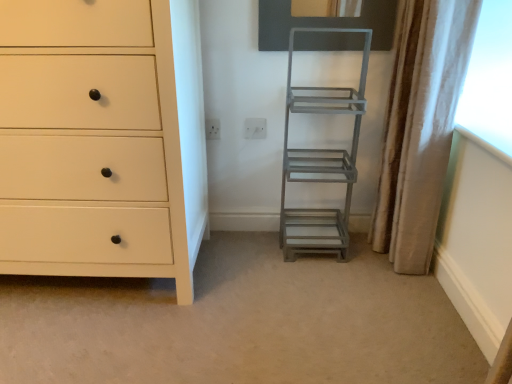
The image size is (512, 384). What are the coordinates of `white plastic electric outlet at center, marked as the first electric outlet in a right-to-left arrangement` in the screenshot? It's located at (255, 128).

Looking at this image, measure the distance between point [207,122] and camera.

Point [207,122] is 1.73 meters away from camera.

You are a GUI agent. You are given a task and a screenshot of the screen. Output one action in this format:
    pyautogui.click(x=<x>, y=<y>)
    Task: Click on the beige fabric curtain at right
    This screenshot has width=512, height=384.
    Given the screenshot: What is the action you would take?
    pyautogui.click(x=422, y=128)

Are matte white chest of drawers at left and white plastic electric outlet at center, marked as the first electric outlet in a right-to-left arrangement, beside each other?

No, matte white chest of drawers at left is not next to white plastic electric outlet at center, marked as the first electric outlet in a right-to-left arrangement.

Considering the sizes of objects matte white chest of drawers at left and white plastic electric outlet at center, the second electric outlet viewed from the left, in the image provided, who is wider, matte white chest of drawers at left or white plastic electric outlet at center, the second electric outlet viewed from the left,?

matte white chest of drawers at left is wider.

Do you think matte white chest of drawers at left is within white plastic electric outlet at center, the second electric outlet viewed from the left, or outside of it?

matte white chest of drawers at left is spatially situated outside white plastic electric outlet at center, the second electric outlet viewed from the left.

Which of these two, matte white chest of drawers at left or white plastic electric outlet at center, marked as the first electric outlet in a right-to-left arrangement, is smaller?

white plastic electric outlet at center, marked as the first electric outlet in a right-to-left arrangement.

Which object is more forward, gray matte metal ladder at center-right or white plastic electric outlet at center, marked as the first electric outlet in a right-to-left arrangement?

gray matte metal ladder at center-right is more forward.

From the picture: How different are the orientations of gray matte metal ladder at center-right and white plastic electric outlet at center, marked as the first electric outlet in a right-to-left arrangement, in degrees?

0.274 degrees separate the facing orientations of gray matte metal ladder at center-right and white plastic electric outlet at center, marked as the first electric outlet in a right-to-left arrangement.

Is there a large distance between gray matte metal ladder at center-right and white plastic electric outlet at center, the second electric outlet viewed from the left?

gray matte metal ladder at center-right is actually quite close to white plastic electric outlet at center, the second electric outlet viewed from the left.

Does gray matte metal ladder at center-right appear on the left side of white plastic electric outlet at center, the second electric outlet viewed from the left?

No, gray matte metal ladder at center-right is not to the left of white plastic electric outlet at center, the second electric outlet viewed from the left.

Is white plastic electric outlet at center, marked as the first electric outlet in a right-to-left arrangement, aimed at white plastic electric outlet at center, the 1th electric outlet from the left?

No, white plastic electric outlet at center, marked as the first electric outlet in a right-to-left arrangement, is not turned towards white plastic electric outlet at center, the 1th electric outlet from the left.

How many degrees apart are the facing directions of white plastic electric outlet at center, the second electric outlet viewed from the left, and white plastic electric outlet at center, the 1th electric outlet from the left?

white plastic electric outlet at center, the second electric outlet viewed from the left, and white plastic electric outlet at center, the 1th electric outlet from the left, are facing 0.0172 degrees away from each other.

Does white plastic electric outlet at center, the second electric outlet viewed from the left, have a larger size compared to white plastic electric outlet at center, the 1th electric outlet from the left?

Indeed, white plastic electric outlet at center, the second electric outlet viewed from the left, has a larger size compared to white plastic electric outlet at center, the 1th electric outlet from the left.

In the scene shown: Can you tell me how much beige fabric curtain at right and matte white chest of drawers at left differ in facing direction?

The angular difference between beige fabric curtain at right and matte white chest of drawers at left is 87.6 degrees.

Considering the sizes of objects beige fabric curtain at right and matte white chest of drawers at left in the image provided, who is smaller, beige fabric curtain at right or matte white chest of drawers at left?

beige fabric curtain at right.

From a real-world perspective, is beige fabric curtain at right positioned above or below matte white chest of drawers at left?

beige fabric curtain at right is situated higher than matte white chest of drawers at left in the real world.

From the image's perspective, is beige fabric curtain at right located above or below matte white chest of drawers at left?

beige fabric curtain at right is situated higher than matte white chest of drawers at left in the image.

Identify the location of curtain above the gray matte metal ladder at center-right (from a real-world perspective). (422, 128).

Would you consider gray matte metal ladder at center-right to be distant from beige fabric curtain at right?

No, gray matte metal ladder at center-right is not far away from beige fabric curtain at right.

Is gray matte metal ladder at center-right situated inside beige fabric curtain at right or outside?

gray matte metal ladder at center-right is outside beige fabric curtain at right.

Which of these two, gray matte metal ladder at center-right or beige fabric curtain at right, is wider?

Wider between the two is gray matte metal ladder at center-right.

Who is shorter, white plastic electric outlet at center, the 2th electric outlet in the right-to-left sequence, or white plastic electric outlet at center, the second electric outlet viewed from the left?

Standing shorter between the two is white plastic electric outlet at center, the 2th electric outlet in the right-to-left sequence.

From the picture: From the image's perspective, would you say white plastic electric outlet at center, the 1th electric outlet from the left, is shown under white plastic electric outlet at center, marked as the first electric outlet in a right-to-left arrangement?

No, from the image's perspective, white plastic electric outlet at center, the 1th electric outlet from the left, is not below white plastic electric outlet at center, marked as the first electric outlet in a right-to-left arrangement.

Can you confirm if white plastic electric outlet at center, the 1th electric outlet from the left, is smaller than white plastic electric outlet at center, the second electric outlet viewed from the left?

Correct, white plastic electric outlet at center, the 1th electric outlet from the left, occupies less space than white plastic electric outlet at center, the second electric outlet viewed from the left.

Can you tell me how much white plastic electric outlet at center, the 1th electric outlet from the left, and beige fabric curtain at right differ in facing direction?

85.9 degrees.

Is white plastic electric outlet at center, the 2th electric outlet in the right-to-left sequence, aimed at beige fabric curtain at right?

No, white plastic electric outlet at center, the 2th electric outlet in the right-to-left sequence, is not aimed at beige fabric curtain at right.

Between white plastic electric outlet at center, the 2th electric outlet in the right-to-left sequence, and beige fabric curtain at right, which one has more height?

beige fabric curtain at right.

Identify the location of chest of drawers in front of the white plastic electric outlet at center, the second electric outlet viewed from the left. The image size is (512, 384). (101, 139).

Identify the location of ladder on the right of white plastic electric outlet at center, the second electric outlet viewed from the left. pos(321,161).

In the scene shown: Looking at the image, which one is located closer to beige fabric curtain at right, matte white chest of drawers at left or white plastic electric outlet at center, the 1th electric outlet from the left?

white plastic electric outlet at center, the 1th electric outlet from the left, lies closer to beige fabric curtain at right than the other object.

Based on their spatial positions, is gray matte metal ladder at center-right or white plastic electric outlet at center, the second electric outlet viewed from the left, closer to matte white chest of drawers at left?

Based on the image, gray matte metal ladder at center-right appears to be nearer to matte white chest of drawers at left.

Estimate the real-world distances between objects in this image. Which object is closer to gray matte metal ladder at center-right, white plastic electric outlet at center, the 2th electric outlet in the right-to-left sequence, or matte white chest of drawers at left?

white plastic electric outlet at center, the 2th electric outlet in the right-to-left sequence.

Considering their positions, is gray matte metal ladder at center-right positioned further to white plastic electric outlet at center, the 2th electric outlet in the right-to-left sequence, than beige fabric curtain at right?

beige fabric curtain at right is further to white plastic electric outlet at center, the 2th electric outlet in the right-to-left sequence.

When comparing their distances from beige fabric curtain at right, does white plastic electric outlet at center, the 2th electric outlet in the right-to-left sequence, or white plastic electric outlet at center, the second electric outlet viewed from the left, seem further?

Based on the image, white plastic electric outlet at center, the 2th electric outlet in the right-to-left sequence, appears to be further to beige fabric curtain at right.

Which object lies further to the anchor point white plastic electric outlet at center, the 2th electric outlet in the right-to-left sequence, white plastic electric outlet at center, marked as the first electric outlet in a right-to-left arrangement, or matte white chest of drawers at left?

The object further to white plastic electric outlet at center, the 2th electric outlet in the right-to-left sequence, is matte white chest of drawers at left.

From the image, which object appears to be nearer to white plastic electric outlet at center, the second electric outlet viewed from the left, gray matte metal ladder at center-right or white plastic electric outlet at center, the 2th electric outlet in the right-to-left sequence?

white plastic electric outlet at center, the 2th electric outlet in the right-to-left sequence, is closer to white plastic electric outlet at center, the second electric outlet viewed from the left.

From the image, which object appears to be nearer to beige fabric curtain at right, white plastic electric outlet at center, the 2th electric outlet in the right-to-left sequence, or matte white chest of drawers at left?

white plastic electric outlet at center, the 2th electric outlet in the right-to-left sequence, lies closer to beige fabric curtain at right than the other object.

Identify the location of electric outlet positioned between gray matte metal ladder at center-right and white plastic electric outlet at center, the second electric outlet viewed from the left, from near to far. The width and height of the screenshot is (512, 384). (212, 129).

Find the location of a particular element. The width and height of the screenshot is (512, 384). electric outlet between white plastic electric outlet at center, the 2th electric outlet in the right-to-left sequence, and beige fabric curtain at right is located at coordinates (255, 128).

At what (x,y) coordinates should I click in order to perform the action: click on ladder between matte white chest of drawers at left and beige fabric curtain at right. Please return your answer as a coordinate pair (x, y). Looking at the image, I should click on pyautogui.click(x=321, y=161).

Where is `electric outlet between matte white chest of drawers at left and white plastic electric outlet at center, the second electric outlet viewed from the left, from front to back`? Image resolution: width=512 pixels, height=384 pixels. electric outlet between matte white chest of drawers at left and white plastic electric outlet at center, the second electric outlet viewed from the left, from front to back is located at coordinates (212, 129).